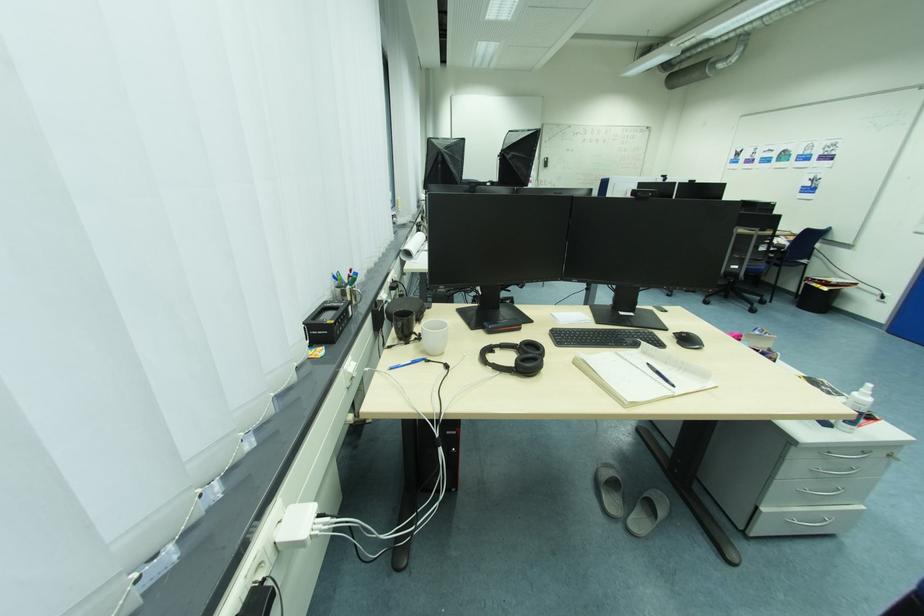
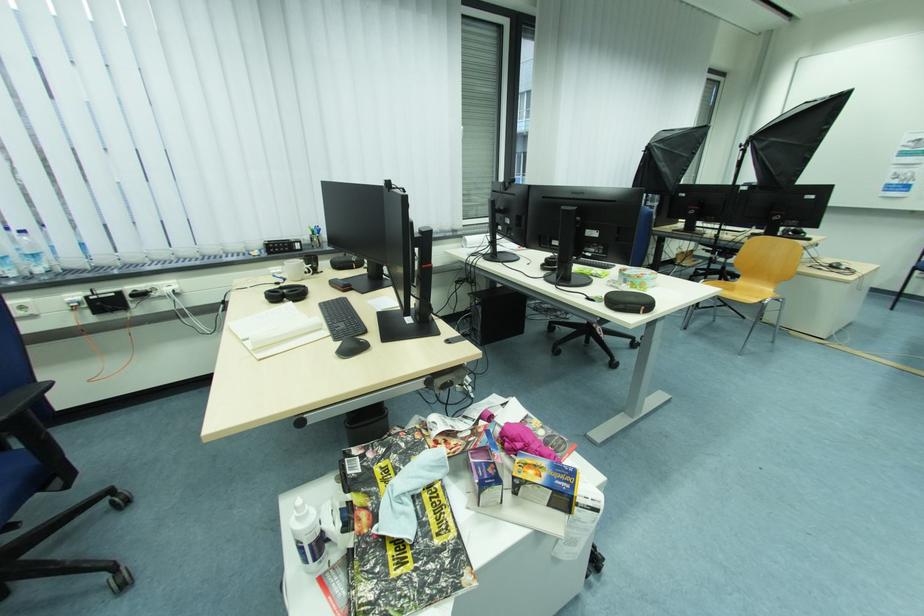
In the second image, find the point that corresponds to the point at 454,368 in the first image.

(284, 285)